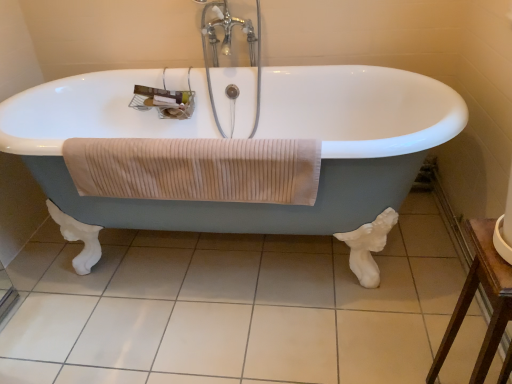
Question: In terms of width, does white tile at center look wider or thinner when compared to brown wooden table at lower right?

Choices:
 (A) wide
 (B) thin

Answer: (A)

Question: From their relative heights in the image, would you say white tile at center is taller or shorter than brown wooden table at lower right?

Choices:
 (A) short
 (B) tall

Answer: (A)

Question: Which of these objects is positioned farthest from the brown wooden table at lower right?

Choices:
 (A) beige ribbed towel at center
 (B) white glossy bathtub at center
 (C) chrome metallic faucet at upper center
 (D) white tile at center

Answer: (C)

Question: Which object is positioned closest to the beige ribbed towel at center?

Choices:
 (A) white tile at center
 (B) chrome metallic faucet at upper center
 (C) white glossy bathtub at center
 (D) brown wooden table at lower right

Answer: (C)